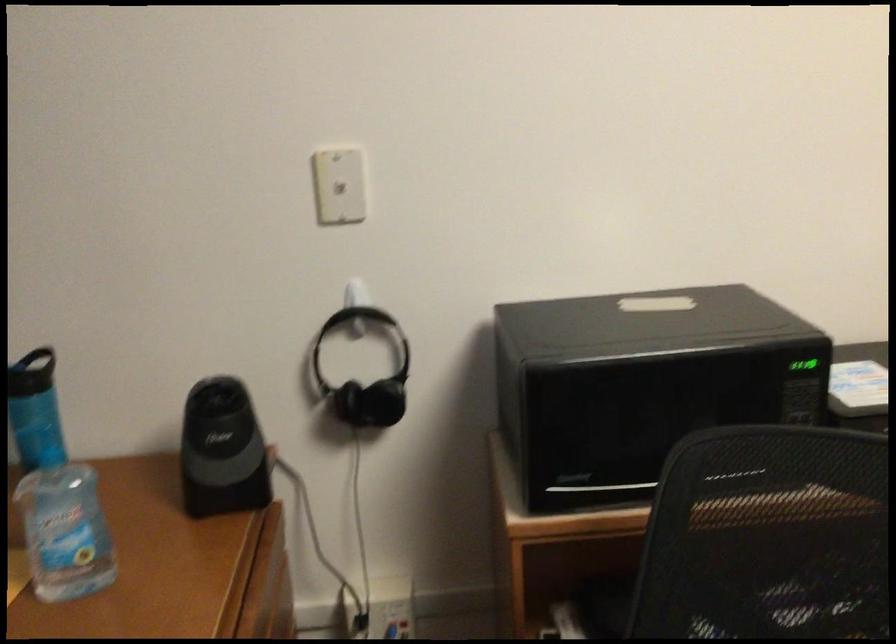
The width and height of the screenshot is (896, 644). I want to click on black headphones, so click(x=365, y=375).